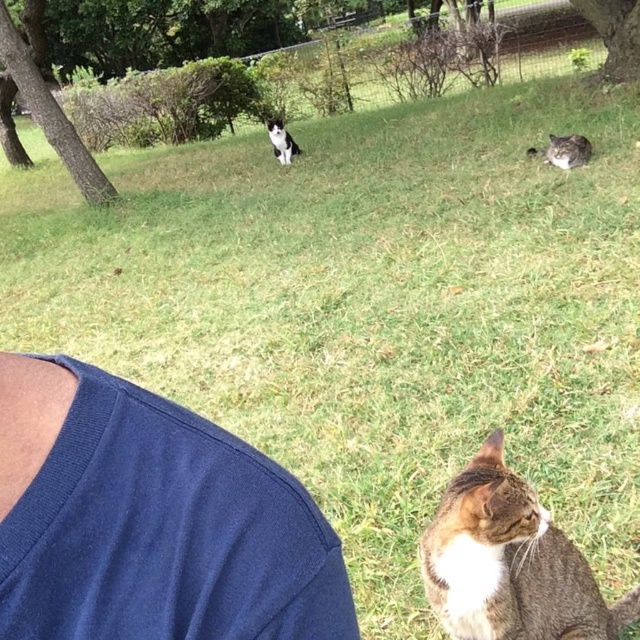
You are a photographer standing at the center of the frame. You want to take a photo of the fuzzy gray cat at upper right without the navy blue fabric at lower left appearing in the shot. Given that your camera has a maximum zoom range of 5 meters, can you capture the desired shot?

The distance between the navy blue fabric at lower left and the fuzzy gray cat at upper right is 4.99 meters. Since your camera can zoom up to 5 meters, you can adjust the zoom to focus on the fuzzy gray cat at upper right while excluding the navy blue fabric at lower left from the frame.